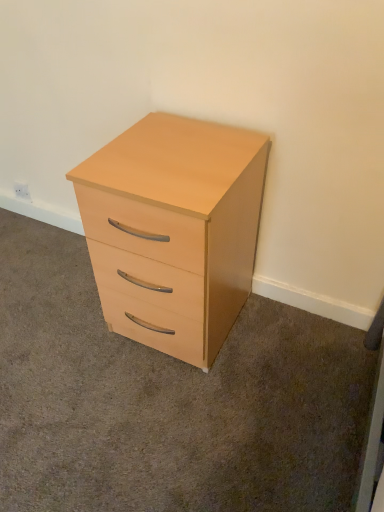
Question: From a real-world perspective, is white plastic electric outlet at upper left physically located above or below light wood/finish chest of drawers at center?

Choices:
 (A) above
 (B) below

Answer: (B)

Question: Would you say white plastic electric outlet at upper left is to the left or to the right of light wood/finish chest of drawers at center in the picture?

Choices:
 (A) right
 (B) left

Answer: (B)

Question: Is point (16, 189) positioned closer to the camera than point (180, 298)?

Choices:
 (A) closer
 (B) farther

Answer: (B)

Question: Considering the positions of point (251, 253) and point (29, 199), is point (251, 253) closer or farther from the camera than point (29, 199)?

Choices:
 (A) closer
 (B) farther

Answer: (A)

Question: From a real-world perspective, relative to white plastic electric outlet at upper left, is light wood/finish chest of drawers at center vertically above or below?

Choices:
 (A) above
 (B) below

Answer: (A)

Question: Is light wood/finish chest of drawers at center inside or outside of white plastic electric outlet at upper left?

Choices:
 (A) outside
 (B) inside

Answer: (A)

Question: In terms of height, does light wood/finish chest of drawers at center look taller or shorter compared to white plastic electric outlet at upper left?

Choices:
 (A) short
 (B) tall

Answer: (B)